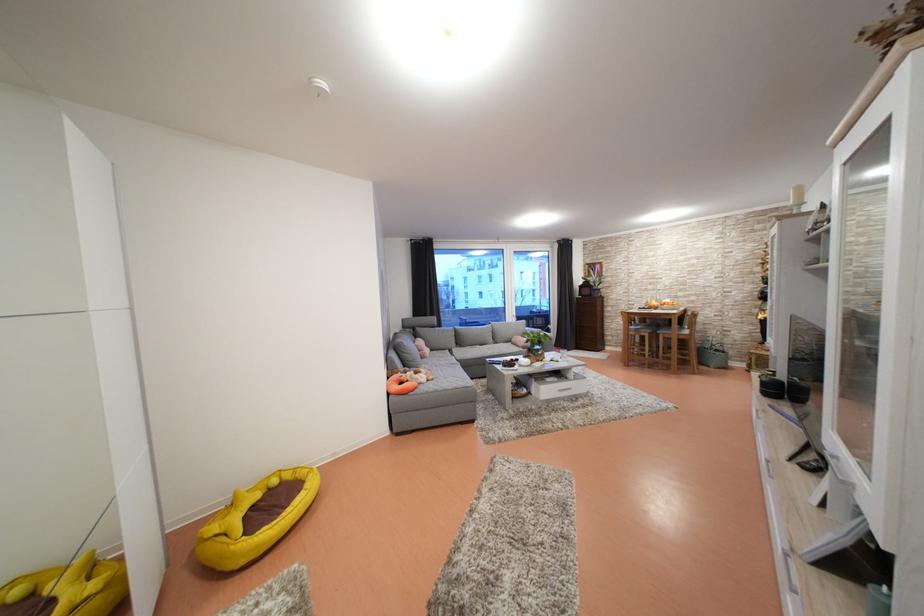
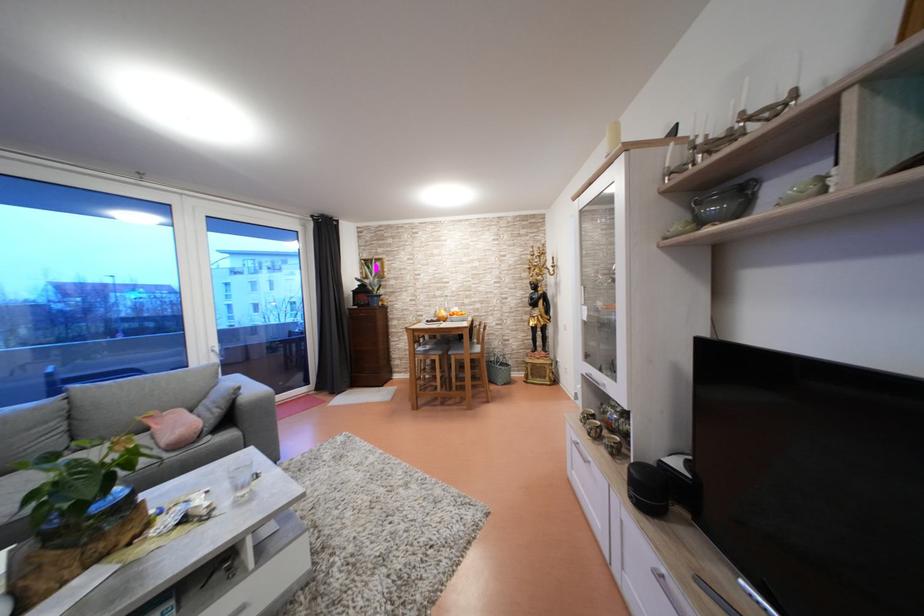
Find the pixel in the second image that matches pixel 658 293 in the first image.

(444, 299)